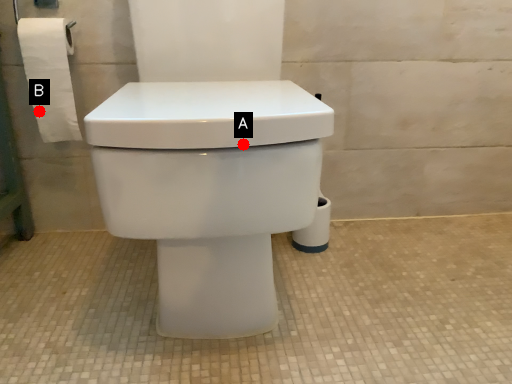
Question: Two points are circled on the image, labeled by A and B beside each circle. Which point appears farthest from the camera in this image?

Choices:
 (A) A is further
 (B) B is further

Answer: (B)